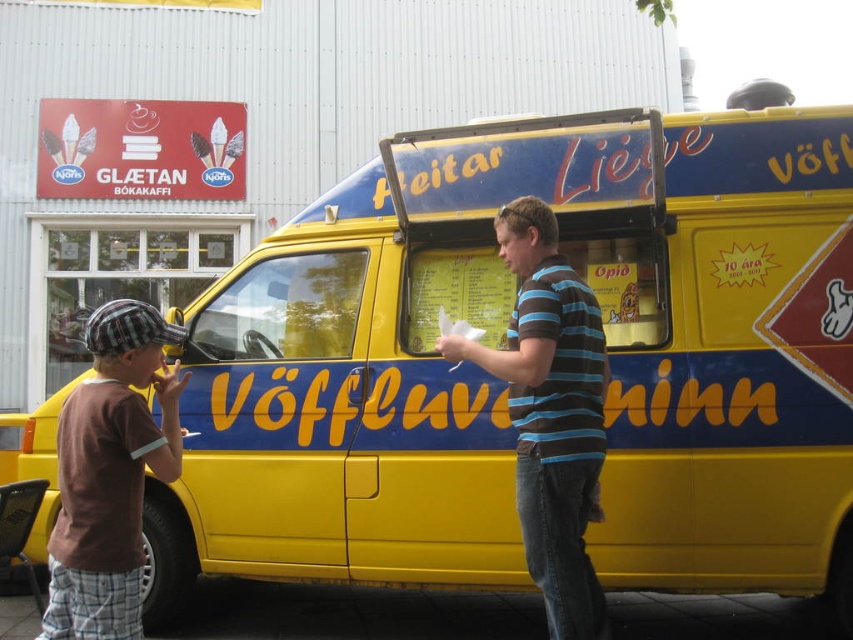
Question: From the image, what is the correct spatial relationship of striped cotton shirt at center in relation to brown cotton shirt at left?

Choices:
 (A) right
 (B) left

Answer: (A)

Question: Among these objects, which one is nearest to the camera?

Choices:
 (A) striped cotton shirt at center
 (B) brown cotton shirt at left

Answer: (B)

Question: Which of the following is the farthest from the observer?

Choices:
 (A) (560, 490)
 (B) (138, 392)

Answer: (A)

Question: Is striped cotton shirt at center positioned in front of brown cotton shirt at left?

Choices:
 (A) yes
 (B) no

Answer: (B)

Question: Can you confirm if striped cotton shirt at center is positioned to the left of brown cotton shirt at left?

Choices:
 (A) no
 (B) yes

Answer: (A)

Question: Which object is closer to the camera taking this photo?

Choices:
 (A) striped cotton shirt at center
 (B) brown cotton shirt at left

Answer: (B)